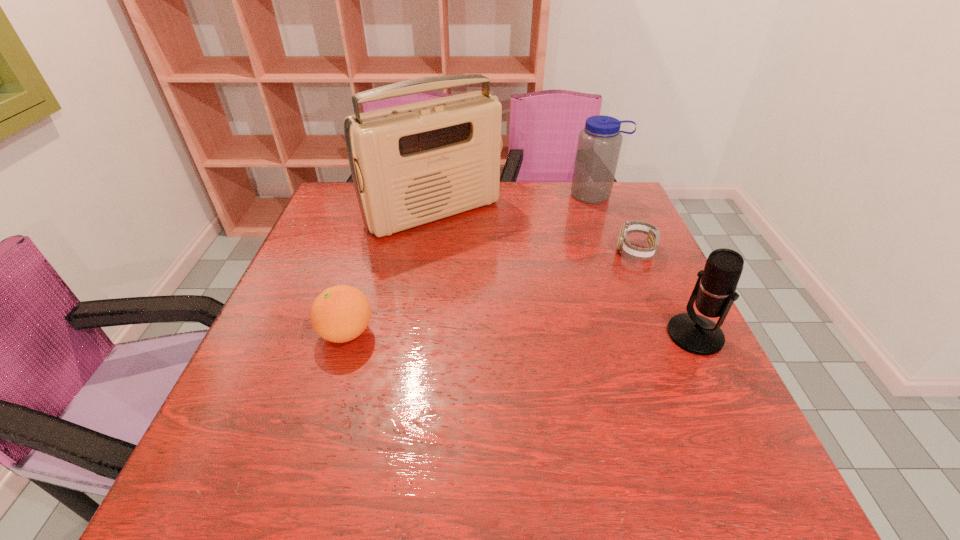
Find the location of `vacant space at the far right corner`. vacant space at the far right corner is located at coordinates (585, 204).

Locate an element on the screen. vacant region between the orange and the radio receiver is located at coordinates point(390,273).

This screenshot has width=960, height=540. What are the coordinates of `free space between the radio receiver and the second shortest object` in the screenshot? It's located at (390, 273).

Image resolution: width=960 pixels, height=540 pixels. What are the coordinates of `vacant area that lies between the orange and the water bottle` in the screenshot? It's located at (470, 264).

Locate an element on the screen. free spot between the shortest object and the orange is located at coordinates (491, 292).

The width and height of the screenshot is (960, 540). I want to click on empty location between the microphone and the water bottle, so click(x=645, y=265).

Where is `unoccupied area between the microphone and the watch`? unoccupied area between the microphone and the watch is located at coordinates (665, 293).

Locate an element on the screen. unoccupied area between the microphone and the fourth tallest object is located at coordinates (520, 334).

The height and width of the screenshot is (540, 960). What are the coordinates of `blank region between the radio receiver and the microphone` in the screenshot? It's located at (564, 274).

This screenshot has width=960, height=540. I want to click on free space between the second shortest object and the watch, so click(491, 292).